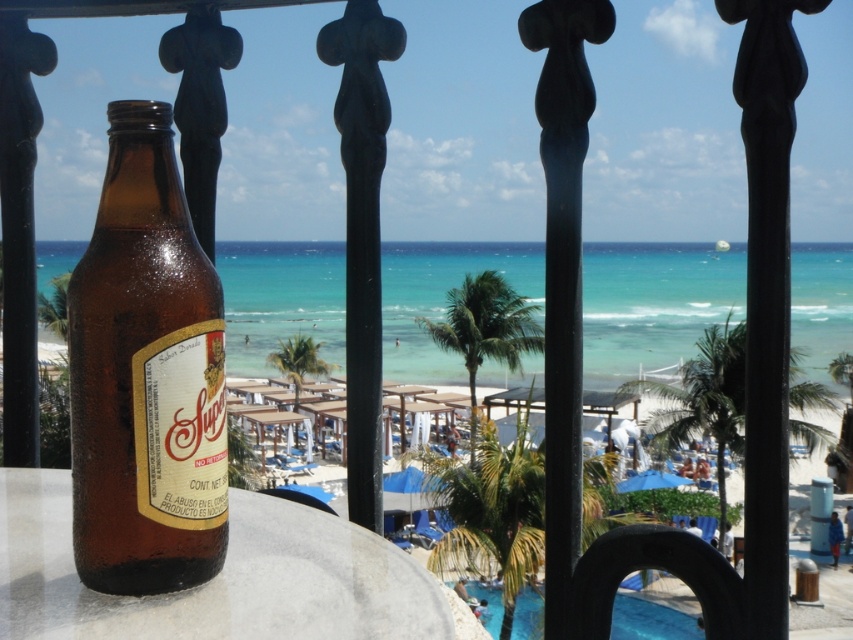
You are planning to set up a small picnic on the smooth white table at center and the blue glossy pool at lower center. Since you have limited space, which surface would you choose to place your picnic items to ensure they fit comfortably?

The blue glossy pool at lower center occupies more space than the smooth white table at center, so you should choose the blue glossy pool at lower center to place your picnic items as it provides more space for comfortable arrangement.

You are a guest at a beachside resort and want to place your drink on a surface. You see the brown glass bottle at left and the blue glossy pool at lower center. Which object is closer to you, and why?

The brown glass bottle at left is closer to you because it is positioned in front of the blue glossy pool at lower center, meaning it is nearer to your viewpoint.

You are at a beach bar and want to place a taller object on the table. Which object between the brown glass bottle at left and the smooth white table at center would be suitable for placing on the table?

The brown glass bottle at left is much taller than the smooth white table at center, so it cannot be placed on the table. You should choose an object shorter than the table.